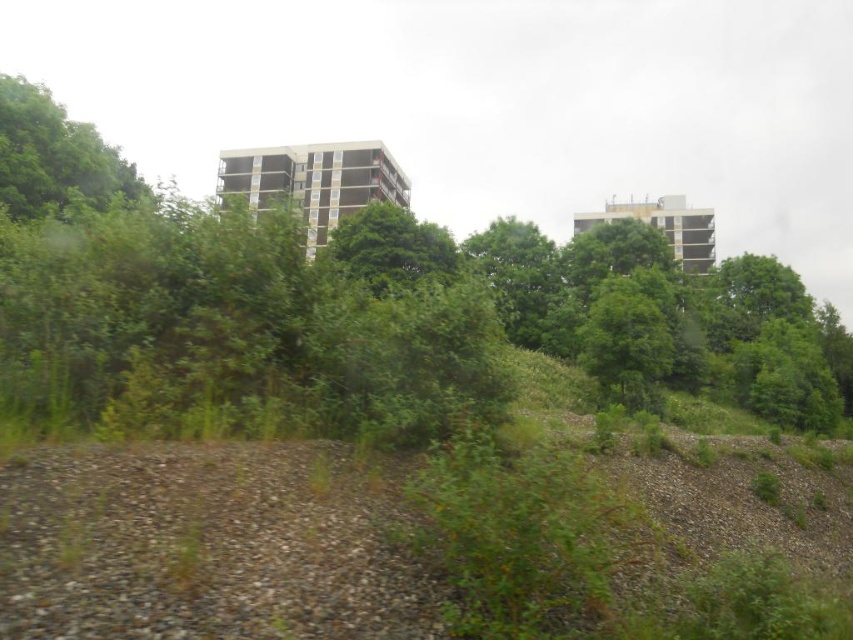
What do you see at coordinates (364, 308) in the screenshot? This screenshot has width=853, height=640. I see `green leafy tree at upper center` at bounding box center [364, 308].

Between point (33, 188) and point (4, 106), which one is positioned in front?

Positioned in front is point (4, 106).

This screenshot has height=640, width=853. In order to click on green leafy tree at upper center in this screenshot , I will do `click(364, 308)`.